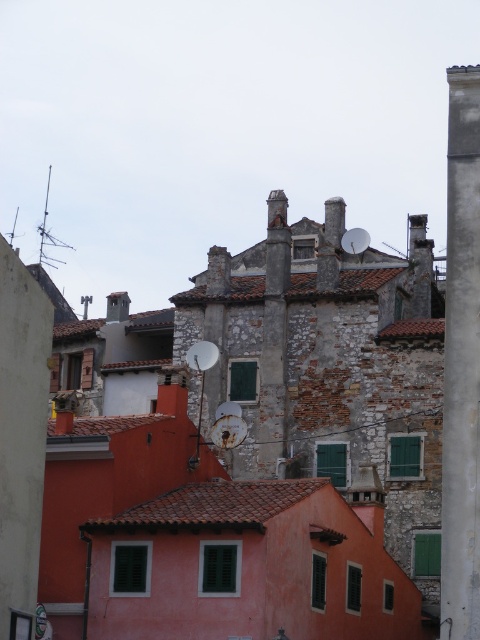
Question: Among these objects, which one is nearest to the camera?

Choices:
 (A) metallic street sign at lower left
 (B) smooth concrete pillar at right

Answer: (B)

Question: Among these objects, which one is farthest from the camera?

Choices:
 (A) metallic street sign at lower left
 (B) smooth concrete pillar at right

Answer: (A)

Question: Among these points, which one is farthest from the camera?

Choices:
 (A) (38, 605)
 (B) (468, 474)

Answer: (A)

Question: Is smooth concrete pillar at right wider than metallic street sign at lower left?

Choices:
 (A) no
 (B) yes

Answer: (B)

Question: Is smooth concrete pillar at right to the right of metallic street sign at lower left from the viewer's perspective?

Choices:
 (A) yes
 (B) no

Answer: (A)

Question: Observing the image, what is the correct spatial positioning of smooth concrete pillar at right in reference to metallic street sign at lower left?

Choices:
 (A) above
 (B) below

Answer: (A)